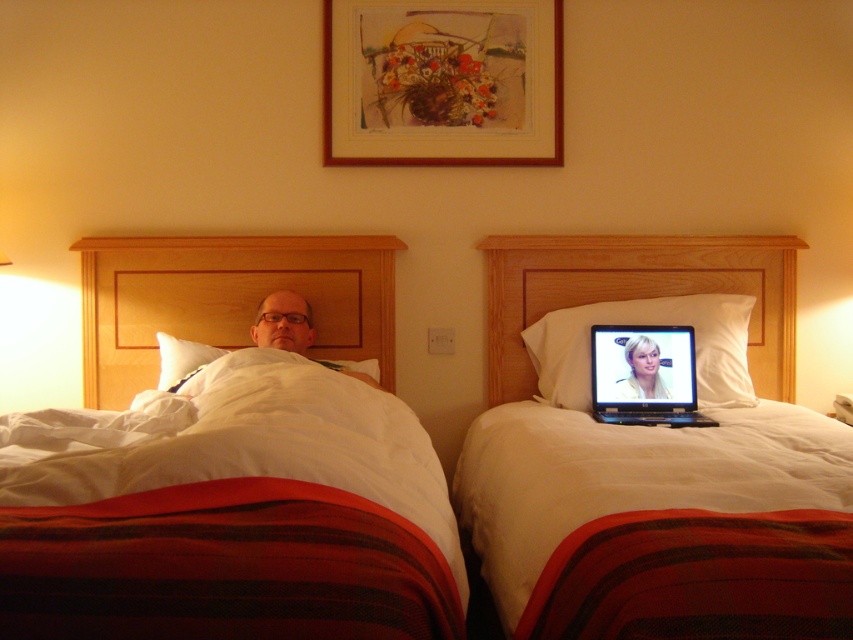
Question: Which point is farther from the camera taking this photo?

Choices:
 (A) (77, 518)
 (B) (723, 244)
 (C) (762, 372)
 (D) (614, 392)

Answer: (C)

Question: Is wooden headboard at upper center to the left of blonde hair at upper center from the viewer's perspective?

Choices:
 (A) no
 (B) yes

Answer: (B)

Question: Is white soft pillow at upper right below blonde hair at upper center?

Choices:
 (A) no
 (B) yes

Answer: (A)

Question: Which point appears farthest from the camera in this image?

Choices:
 (A) (426, 67)
 (B) (520, 300)
 (C) (252, 256)

Answer: (B)

Question: Can you confirm if wooden picture frame at upper center is positioned above white soft bed at upper center?

Choices:
 (A) yes
 (B) no

Answer: (A)

Question: Among these points, which one is farthest from the camera?

Choices:
 (A) (523, 280)
 (B) (44, 490)
 (C) (637, 365)

Answer: (A)